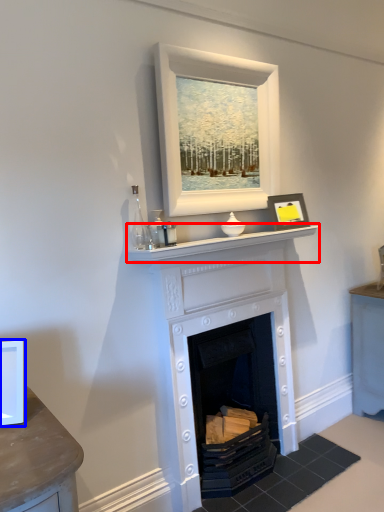
Question: Which object appears farthest to the camera in this image, mantle (highlighted by a red box) or picture frame (highlighted by a blue box)?

Choices:
 (A) mantle
 (B) picture frame

Answer: (A)